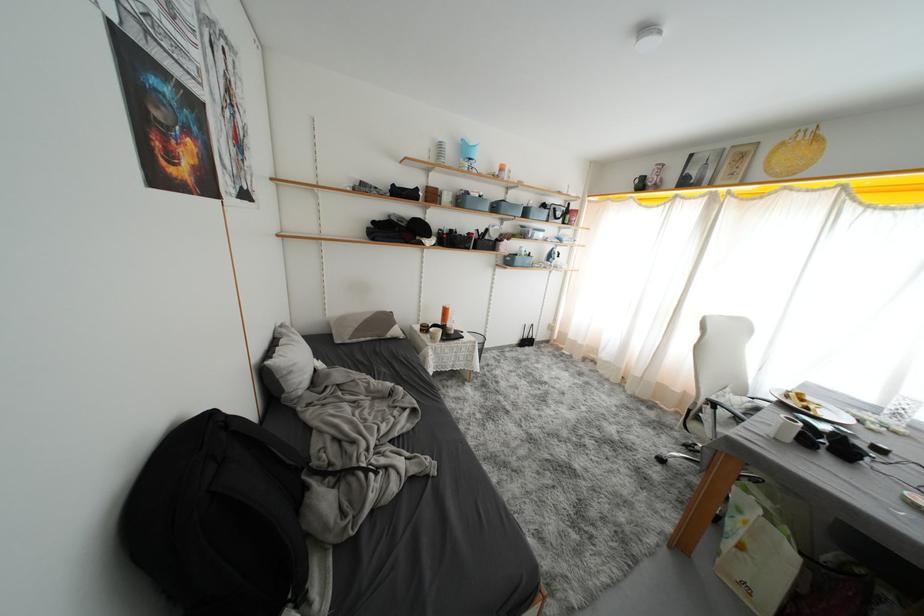
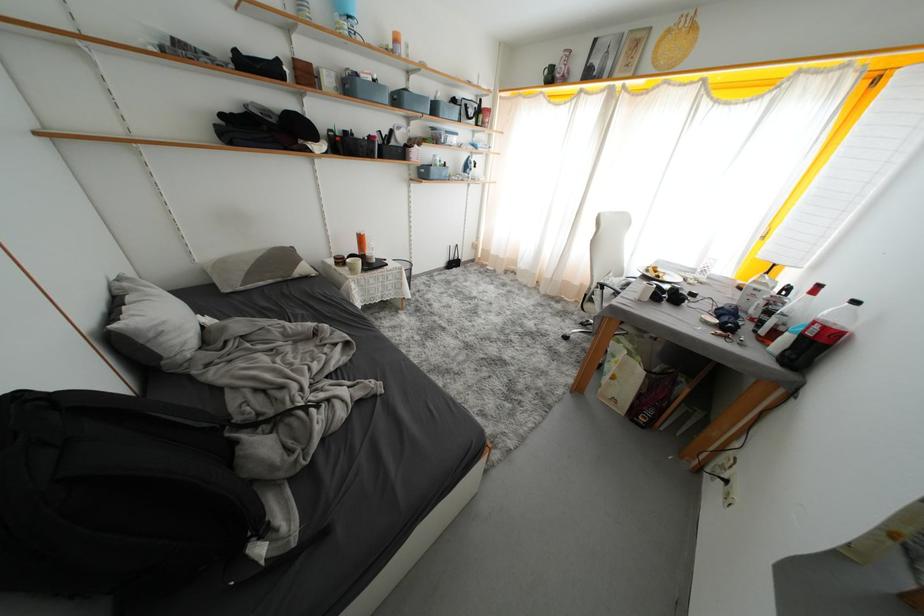
Locate, in the second image, the point that corresponds to (502,212) in the first image.

(404, 103)